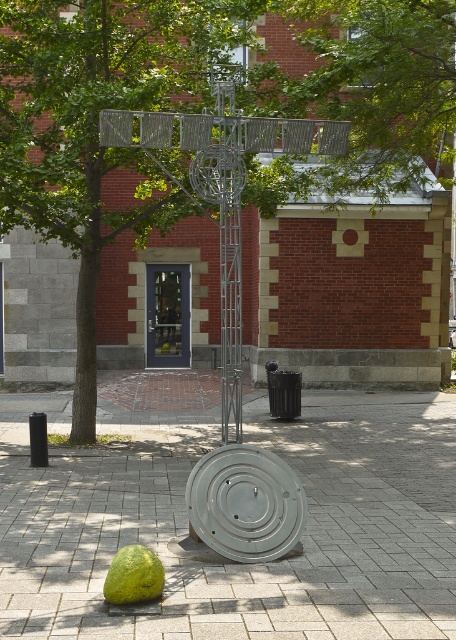
Question: Which object is the closest to the green leafy tree at center?

Choices:
 (A) green leafy tree at upper center
 (B) white concrete pavement at center

Answer: (A)

Question: Which of these objects is positioned farthest from the green leafy tree at center?

Choices:
 (A) white concrete pavement at center
 (B) green leafy tree at upper center

Answer: (A)

Question: Is white concrete pavement at center to the left of green leafy tree at upper center from the viewer's perspective?

Choices:
 (A) yes
 (B) no

Answer: (A)

Question: Which point is farther to the camera?

Choices:
 (A) (66, 125)
 (B) (243, 614)
 (C) (338, 67)

Answer: (C)

Question: Can you confirm if white concrete pavement at center is thinner than green leafy tree at center?

Choices:
 (A) no
 (B) yes

Answer: (A)

Question: Is white concrete pavement at center to the right of green leafy tree at center from the viewer's perspective?

Choices:
 (A) no
 (B) yes

Answer: (A)